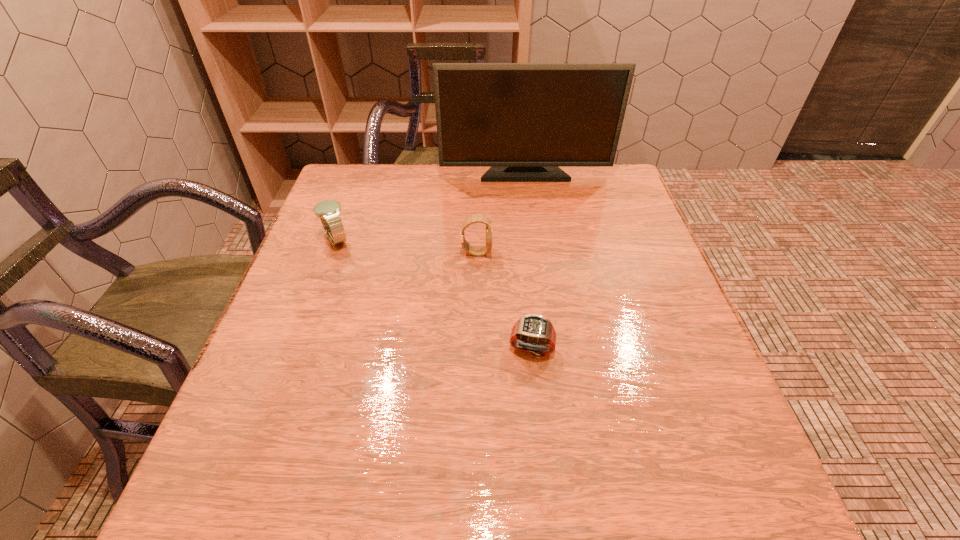
Locate an element on the screen. The height and width of the screenshot is (540, 960). the tallest object is located at coordinates (523, 120).

What are the coordinates of `monitor` in the screenshot? It's located at (523, 120).

Find the location of `the second watch from right to left`. the second watch from right to left is located at coordinates (479, 218).

I want to click on the leftmost watch, so click(328, 211).

Locate an element on the screen. This screenshot has height=540, width=960. the rightmost watch is located at coordinates (533, 333).

Locate an element on the screen. The width and height of the screenshot is (960, 540). the nearest watch is located at coordinates coord(533,333).

In order to click on vacant space located 0.320m on the screen side of the farthest object in this screenshot , I will do `click(537, 257)`.

Find the location of a particular element. Image resolution: width=960 pixels, height=540 pixels. vacant space situated on the face of the second watch from left to right is located at coordinates [x=656, y=253].

Find the location of a particular element. This screenshot has width=960, height=540. free space located 0.180m on the front of the leftmost object is located at coordinates (309, 311).

Where is `vacant space located on the front of the shortest watch`? This screenshot has width=960, height=540. vacant space located on the front of the shortest watch is located at coordinates (546, 485).